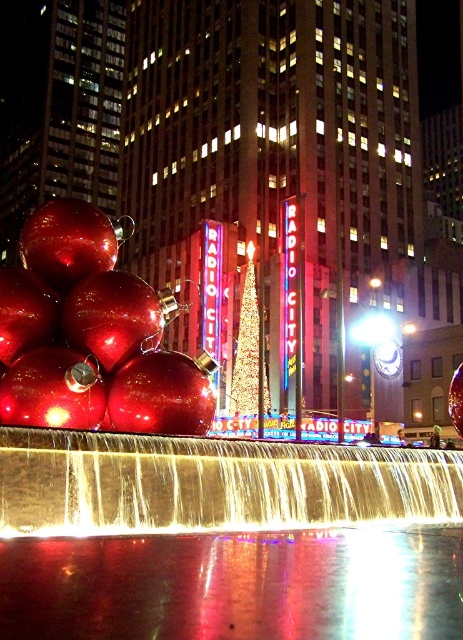
You are standing in front of Radio City Music Hall and see the reflective glass waterfall at center and the gold glittering christmas tree at center. Which object is located to the right side?

The gold glittering christmas tree at center is located to the right side of the reflective glass waterfall at center.